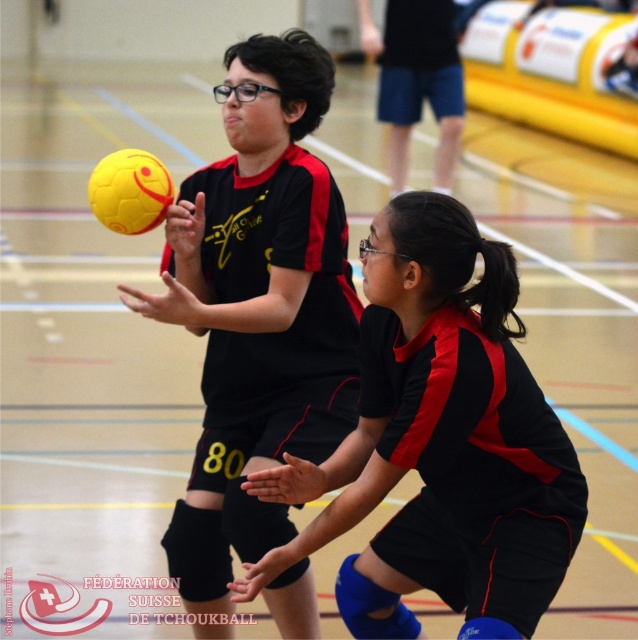
You are a player in a Tchoukball game and you see the yellow matte ball at upper left and the yellow matte volleyball at center. Which one is higher in the air?

The yellow matte ball at upper left is higher in the air compared to the yellow matte volleyball at center.

You are a spectator sitting at the back of the indoor sports hall watching the Tchoukball game. Two points are marked on the floor at coordinates point (350, 458) and point (202, 541). Which point appears closer to you?

Point (350, 458) is closer to the viewer than point (202, 541), so the point at (350, 458) appears closer to you.

You are a player in the Tchoukball game. You are standing at point (x=105, y=202) and want to pass the ball to your teammate at point (x=302, y=381). Is there a clear path between your current position and your teammate? Explain using the spatial relationship between the two points.

Point (x=302, y=381) is behind point (x=105, y=202), so there is a clear path between your current position and your teammate because being behind means there is no obstruction in between.